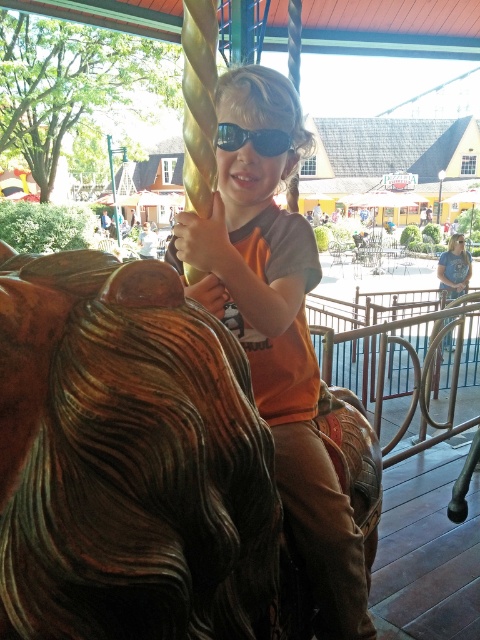
Question: Does orange matte shirt at center have a lesser width compared to black reflective sunglasses at center?

Choices:
 (A) no
 (B) yes

Answer: (A)

Question: Can you confirm if orange matte shirt at center is positioned to the left of black reflective sunglasses at center?

Choices:
 (A) no
 (B) yes

Answer: (A)

Question: Can you confirm if orange matte shirt at center is positioned to the left of black reflective sunglasses at center?

Choices:
 (A) no
 (B) yes

Answer: (A)

Question: Which point is closer to the camera taking this photo?

Choices:
 (A) (368, 627)
 (B) (243, 131)

Answer: (B)